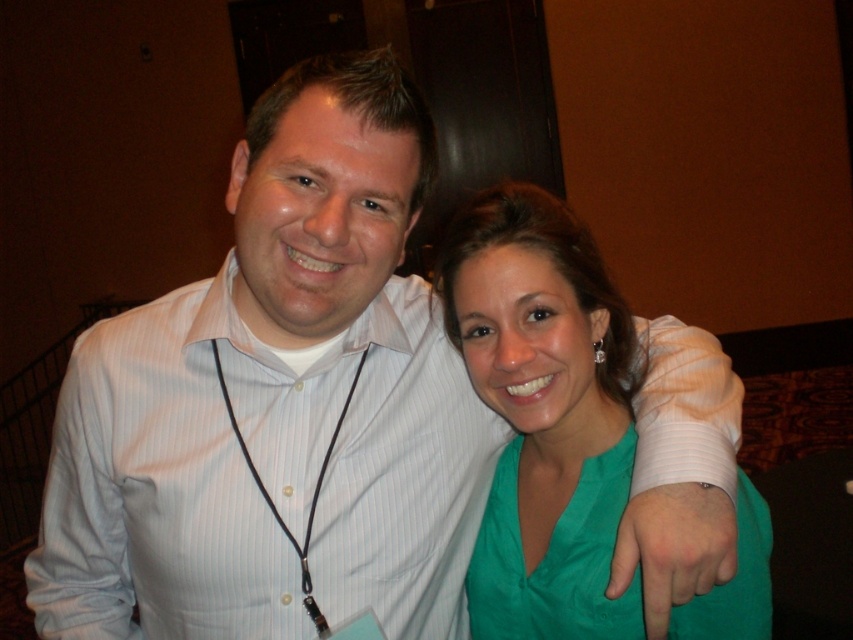
You are a photographer trying to focus on the white striped shirt at center and the white bandage at upper right. Which object is closer to you?

The white striped shirt at center is closer to you than the white bandage at upper right.

You are a photographer adjusting the camera settings to ensure both the white striped shirt at center and the white bandage at upper right are in focus. Which object is positioned lower in the frame?

The white striped shirt at center is positioned below the white bandage at upper right, so it is lower in the frame.

You are a photographer trying to frame two people in a photo. You have a rectangular frame that can only accommodate a total width of 1.2 meters. The white striped shirt at center and the green satin dress at center are both in the center. Can both fit within the frame if their combined widths are exactly 1.2 meters?

The white striped shirt at center is wider than the green satin dress at center. If their combined widths equal exactly 1.2 meters, then both can fit within the frame since the total width matches the frame capacity.